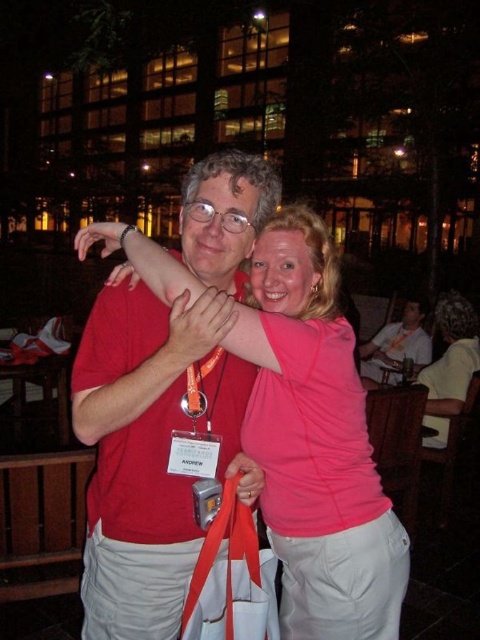
You are standing in the nighttime scene and want to take a photo of the point at coordinates (396, 376). The camera you have can only focus on objects within 20 feet. Will the camera be able to focus on the point?

The point at coordinates (396, 376) is 19.56 feet away from the viewer, which is within the camera focus range of 20 feet. Therefore, the camera can focus on the point.

In the scene shown: You are a photographer trying to capture the best angle of the scene. There is a point marked at coordinates (396, 348). Where is this point located in the scene?

The point at coordinates (396, 348) is on the light brown wooden chair at lower right.